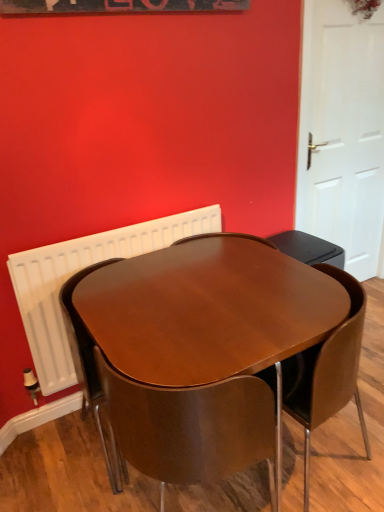
Question: Considering the relative sizes of glossy wood table at center and white radiator at upper left in the image provided, is glossy wood table at center bigger than white radiator at upper left?

Choices:
 (A) yes
 (B) no

Answer: (A)

Question: Is glossy wood table at center far away from white radiator at upper left?

Choices:
 (A) no
 (B) yes

Answer: (A)

Question: Does glossy wood table at center have a greater width compared to white radiator at upper left?

Choices:
 (A) yes
 (B) no

Answer: (A)

Question: From the image's perspective, is glossy wood table at center located above white radiator at upper left?

Choices:
 (A) yes
 (B) no

Answer: (B)

Question: Considering the relative sizes of glossy wood table at center and white radiator at upper left in the image provided, is glossy wood table at center thinner than white radiator at upper left?

Choices:
 (A) no
 (B) yes

Answer: (A)

Question: Is the depth of glossy wood table at center less than that of white radiator at upper left?

Choices:
 (A) yes
 (B) no

Answer: (A)

Question: From the image's perspective, does white matte door at right appear lower than white radiator at upper left?

Choices:
 (A) no
 (B) yes

Answer: (A)

Question: Can you confirm if white matte door at right is wider than white radiator at upper left?

Choices:
 (A) no
 (B) yes

Answer: (B)

Question: From a real-world perspective, does white matte door at right sit lower than white radiator at upper left?

Choices:
 (A) no
 (B) yes

Answer: (A)

Question: Is white matte door at right turned away from white radiator at upper left?

Choices:
 (A) yes
 (B) no

Answer: (B)

Question: Can you confirm if white matte door at right is smaller than white radiator at upper left?

Choices:
 (A) yes
 (B) no

Answer: (B)

Question: Is the position of white matte door at right less distant than that of white radiator at upper left?

Choices:
 (A) yes
 (B) no

Answer: (B)

Question: Is wooden chair at center, arranged as the 2th chair when viewed from the right, facing away from glossy wood table at center?

Choices:
 (A) yes
 (B) no

Answer: (A)